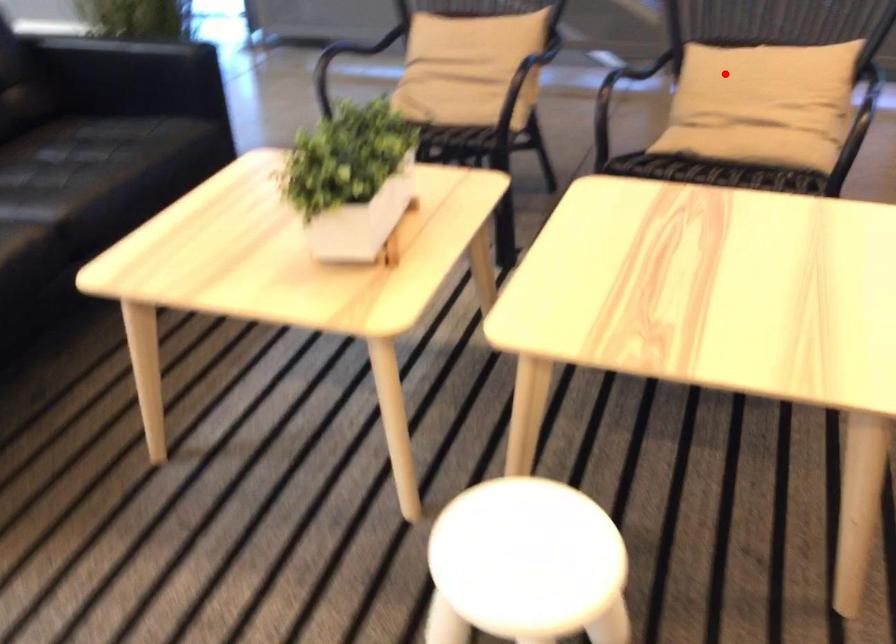
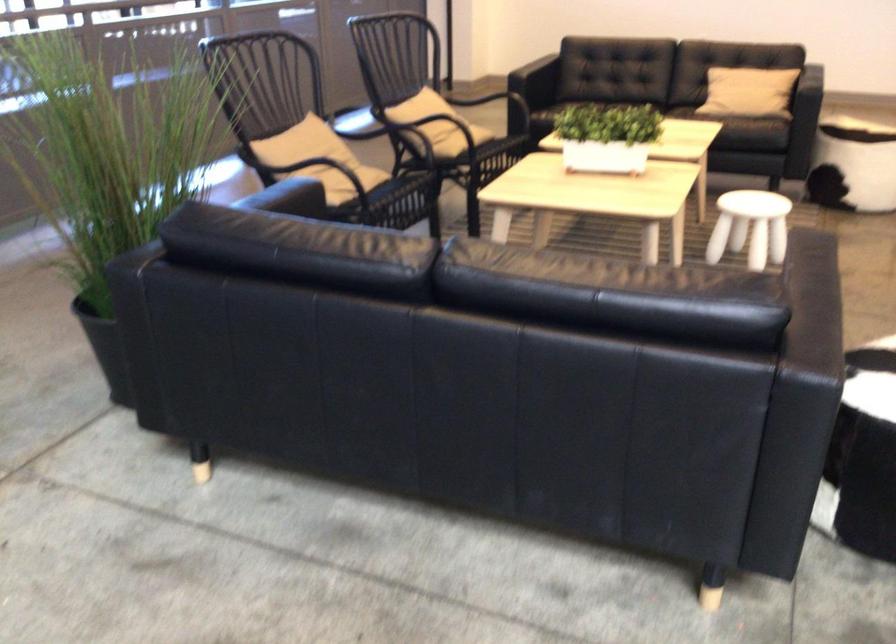
Question: I am providing you with two images of the same scene from different viewpoints. Given a red point in image1, look at the same physical point in image2. Is it:

Choices:
 (A) Closer to the viewpoint
 (B) Farther from the viewpoint

Answer: (B)